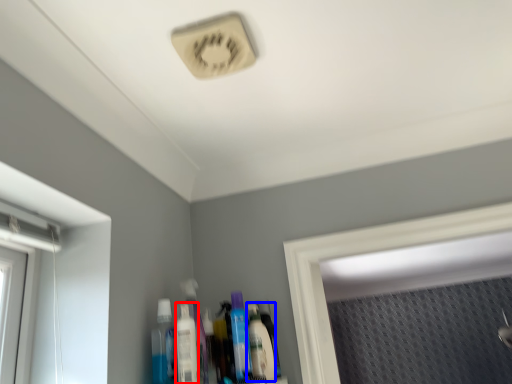
Question: Among these objects, which one is farthest to the camera, mouthwash (highlighted by a red box) or mouthwash (highlighted by a blue box)?

Choices:
 (A) mouthwash
 (B) mouthwash

Answer: (B)